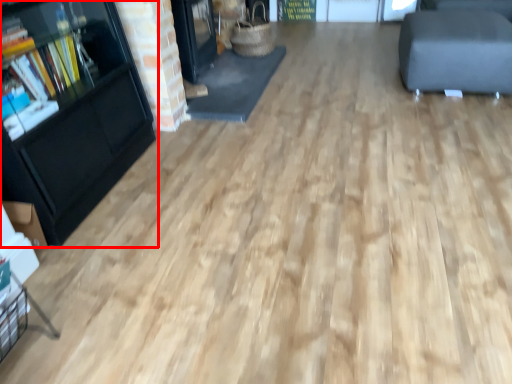
Question: Considering the relative positions of bookcase (annotated by the red box) and furniture in the image provided, where is bookcase (annotated by the red box) located with respect to the staircase?

Choices:
 (A) left
 (B) right

Answer: (A)